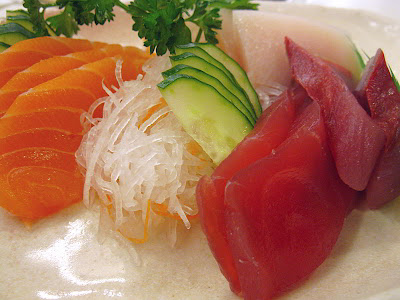
I want to click on beige surface for the food, so click(43, 272).